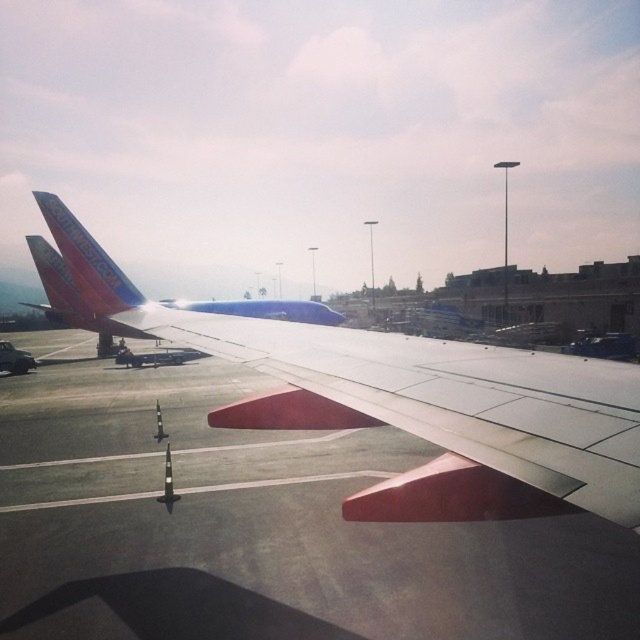
Does smooth concrete tarmac at center come in front of matte white wing at center?

No, it is not.

Image resolution: width=640 pixels, height=640 pixels. I want to click on smooth concrete tarmac at center, so click(257, 525).